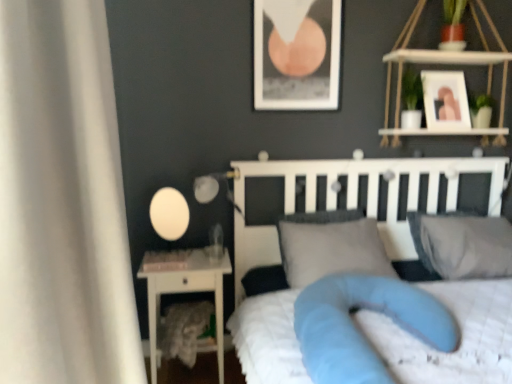
Question: Could you tell me if gray fabric pillow at upper right, marked as the 1th pillow in a right-to-left arrangement, is turned towards matte white glass at left, the 1th table lamp viewed from the right?

Choices:
 (A) yes
 (B) no

Answer: (B)

Question: From the image's perspective, does gray fabric pillow at upper right, arranged as the 2th pillow when viewed from the left, appear higher than matte white glass at left, the 1th table lamp viewed from the right?

Choices:
 (A) no
 (B) yes

Answer: (A)

Question: Would you say gray fabric pillow at upper right, marked as the 1th pillow in a right-to-left arrangement, contains matte white glass at left, the 2th table lamp in the left-to-right sequence?

Choices:
 (A) yes
 (B) no

Answer: (B)

Question: Does gray fabric pillow at upper right, marked as the 1th pillow in a right-to-left arrangement, lie in front of matte white glass at left, the 1th table lamp viewed from the right?

Choices:
 (A) no
 (B) yes

Answer: (B)

Question: Considering the relative sizes of gray fabric pillow at upper right, marked as the 1th pillow in a right-to-left arrangement, and matte white glass at left, the 2th table lamp in the left-to-right sequence, in the image provided, is gray fabric pillow at upper right, marked as the 1th pillow in a right-to-left arrangement, bigger than matte white glass at left, the 2th table lamp in the left-to-right sequence,?

Choices:
 (A) yes
 (B) no

Answer: (A)

Question: Based on their sizes in the image, would you say white soft bed at center is bigger or smaller than matte white glass at left, the 1th table lamp viewed from the right?

Choices:
 (A) small
 (B) big

Answer: (B)

Question: Does point (337, 175) appear closer or farther from the camera than point (212, 185)?

Choices:
 (A) farther
 (B) closer

Answer: (A)

Question: Considering the relative positions of white soft bed at center and matte white glass at left, the 1th table lamp viewed from the right, in the image provided, is white soft bed at center to the left or to the right of matte white glass at left, the 1th table lamp viewed from the right,?

Choices:
 (A) right
 (B) left

Answer: (A)

Question: Considering the positions of white soft bed at center and matte white glass at left, the 2th table lamp in the left-to-right sequence, in the image, is white soft bed at center taller or shorter than matte white glass at left, the 2th table lamp in the left-to-right sequence,?

Choices:
 (A) tall
 (B) short

Answer: (A)

Question: Is white soft bed at center inside or outside of white glossy picture frame at upper right, the first picture frame from the right?

Choices:
 (A) outside
 (B) inside

Answer: (A)

Question: From the image's perspective, is white soft bed at center above or below white glossy picture frame at upper right, the second picture frame viewed from the left?

Choices:
 (A) below
 (B) above

Answer: (A)

Question: Does point [x=344, y=163] appear closer or farther from the camera than point [x=458, y=82]?

Choices:
 (A) closer
 (B) farther

Answer: (B)

Question: Looking at the image, does white soft bed at center seem bigger or smaller compared to white glossy picture frame at upper right, the first picture frame from the right?

Choices:
 (A) small
 (B) big

Answer: (B)

Question: In the image, is white glossy nightstand at left on the left side or the right side of gray fabric pillow at center, the 2th pillow positioned from the right?

Choices:
 (A) left
 (B) right

Answer: (A)

Question: Is white glossy nightstand at left bigger or smaller than gray fabric pillow at center, the 1th pillow when ordered from left to right?

Choices:
 (A) small
 (B) big

Answer: (B)